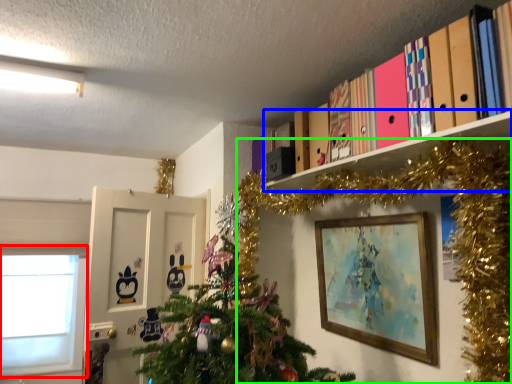
Question: Which object is the farthest from window (highlighted by a red box)? Choose among these: shelf (highlighted by a blue box) or christmas tree (highlighted by a green box).

Choices:
 (A) shelf
 (B) christmas tree

Answer: (A)